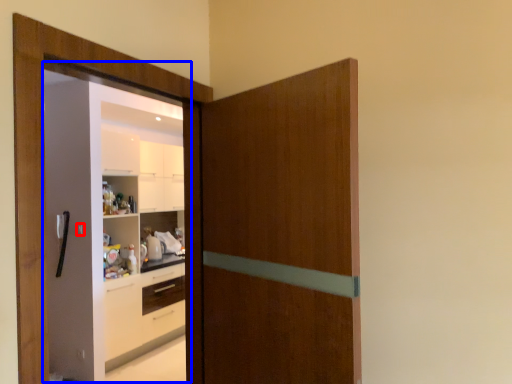
Question: Which object appears farthest to the camera in this image, door handle (highlighted by a red box) or screen door (highlighted by a blue box)?

Choices:
 (A) door handle
 (B) screen door

Answer: (A)